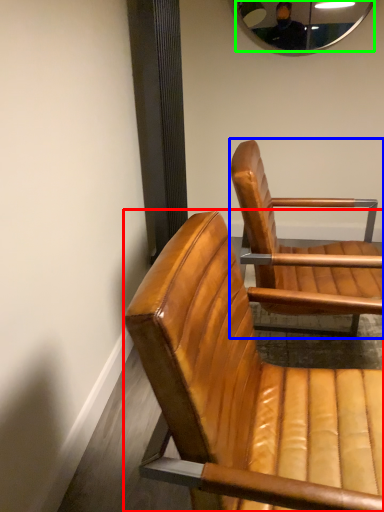
Question: Based on their relative distances, which object is farther from chair (highlighted by a red box)? Choose from chair (highlighted by a blue box) and mirror (highlighted by a green box).

Choices:
 (A) chair
 (B) mirror

Answer: (B)